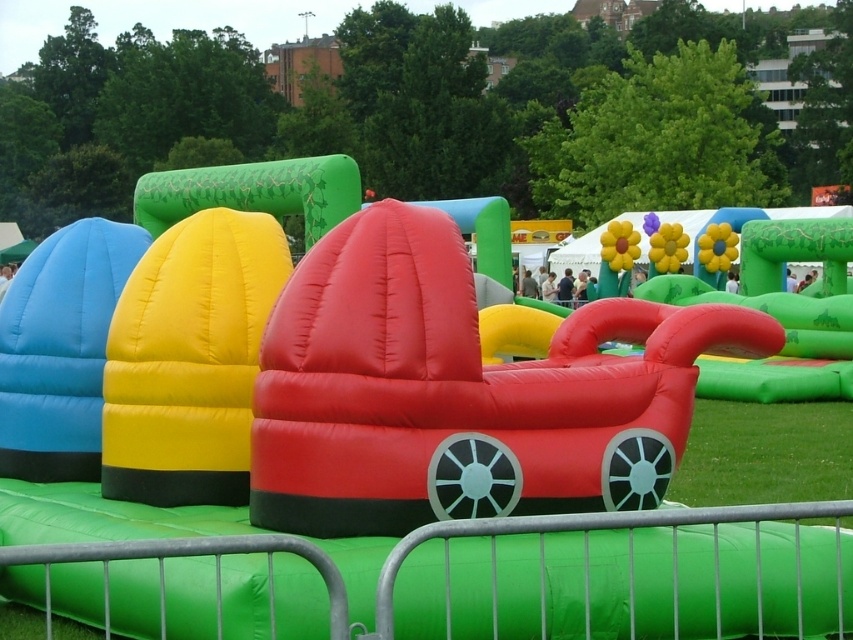
Does point (288, 324) lie behind point (706, 504)?

No, (288, 324) is in front of (706, 504).

Is rubberized red car at center to the right of green grass at lower right from the viewer's perspective?

In fact, rubberized red car at center is to the left of green grass at lower right.

Is point (357, 371) closer to viewer compared to point (759, 490)?

Yes, point (357, 371) is in front of point (759, 490).

The height and width of the screenshot is (640, 853). What are the coordinates of `rubberized red car at center` in the screenshot? It's located at (460, 392).